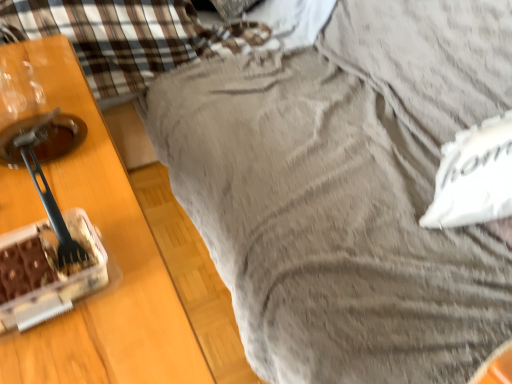
Find the location of a particular element. wooden table at left is located at coordinates (112, 268).

What do you see at coordinates (112, 268) in the screenshot? I see `wooden table at left` at bounding box center [112, 268].

This screenshot has width=512, height=384. What do you see at coordinates (474, 176) in the screenshot? I see `white fabric pillow at right` at bounding box center [474, 176].

Identify the location of white fabric pillow at right. (474, 176).

I want to click on wooden table at left, so click(x=112, y=268).

Which is more to the left, wooden table at left or white fabric pillow at right?

Positioned to the left is wooden table at left.

Considering their positions, is wooden table at left located in front of or behind white fabric pillow at right?

In the image, wooden table at left appears in front of white fabric pillow at right.

Is point (158, 351) positioned in front of point (448, 179)?

Yes, point (158, 351) is in front of point (448, 179).

From the image's perspective, which is above, wooden table at left or white fabric pillow at right?

white fabric pillow at right is shown above in the image.

From a real-world perspective, between wooden table at left and white fabric pillow at right, who is vertically higher?

In real-world perspective, white fabric pillow at right is above.

Is wooden table at left wider than white fabric pillow at right?

Yes, wooden table at left is wider than white fabric pillow at right.

From their relative heights in the image, would you say wooden table at left is taller or shorter than white fabric pillow at right?

Clearly, wooden table at left is taller compared to white fabric pillow at right.

Considering the relative sizes of wooden table at left and white fabric pillow at right in the image provided, is wooden table at left smaller than white fabric pillow at right?

No.

Is wooden table at left surrounding white fabric pillow at right?

Definitely not — white fabric pillow at right is not inside wooden table at left.

Is wooden table at left directly adjacent to white fabric pillow at right?

There is a gap between wooden table at left and white fabric pillow at right.

Is wooden table at left facing towards white fabric pillow at right?

No, wooden table at left is not turned towards white fabric pillow at right.

Looking at this image, how distant is wooden table at left from white fabric pillow at right?

wooden table at left and white fabric pillow at right are 27.68 inches apart.

Where is `pillow that is on the right side of wooden table at left`? pillow that is on the right side of wooden table at left is located at coordinates (474, 176).

Considering the relative positions of white fabric pillow at right and wooden table at left in the image provided, is white fabric pillow at right to the right of wooden table at left from the viewer's perspective?

Indeed, white fabric pillow at right is positioned on the right side of wooden table at left.

In the image, is white fabric pillow at right positioned in front of or behind wooden table at left?

Clearly, white fabric pillow at right is behind wooden table at left.

Does point (439, 201) come farther from viewer compared to point (136, 325)?

Yes, it is behind point (136, 325).

From the image's perspective, does white fabric pillow at right appear lower than wooden table at left?

Incorrect, from the image's perspective, white fabric pillow at right is higher than wooden table at left.

From a real-world perspective, is white fabric pillow at right over wooden table at left?

Indeed, from a real-world perspective, white fabric pillow at right stands above wooden table at left.

Considering the relative sizes of white fabric pillow at right and wooden table at left in the image provided, is white fabric pillow at right wider than wooden table at left?

In fact, white fabric pillow at right might be narrower than wooden table at left.

Can you confirm if white fabric pillow at right is shorter than wooden table at left?

Indeed, white fabric pillow at right has a lesser height compared to wooden table at left.

Based on their sizes in the image, would you say white fabric pillow at right is bigger or smaller than wooden table at left?

Clearly, white fabric pillow at right is smaller in size than wooden table at left.

Could wooden table at left be considered to be inside white fabric pillow at right?

That's incorrect, wooden table at left is not inside white fabric pillow at right.

Is white fabric pillow at right far from wooden table at left?

No, there isn't a large distance between white fabric pillow at right and wooden table at left.

Is white fabric pillow at right aimed at wooden table at left?

Yes, white fabric pillow at right is turned towards wooden table at left.

Can you tell me how much white fabric pillow at right and wooden table at left differ in facing direction?

There is a 46.1-degree angle between the facing directions of white fabric pillow at right and wooden table at left.

At what (x,y) coordinates should I click in order to perform the action: click on furniture in front of the white fabric pillow at right. Please return your answer as a coordinate pair (x, y). Looking at the image, I should click on (112, 268).

This screenshot has height=384, width=512. I want to click on furniture in front of the white fabric pillow at right, so click(112, 268).

Where is `pillow located on the right of wooden table at left`? The height and width of the screenshot is (384, 512). pillow located on the right of wooden table at left is located at coordinates (474, 176).